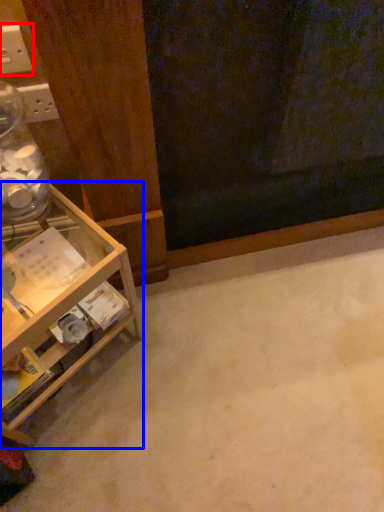
Question: Which object appears closest to the camera in this image, electric outlet (highlighted by a red box) or shelf (highlighted by a blue box)?

Choices:
 (A) electric outlet
 (B) shelf

Answer: (B)